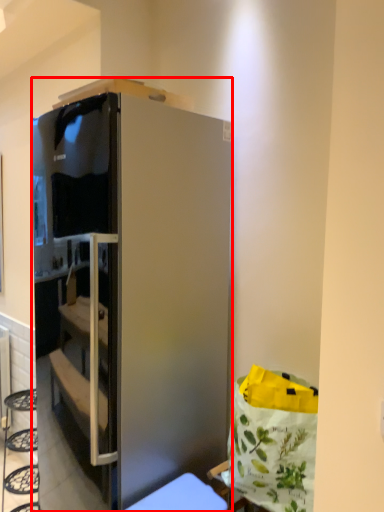
Question: Where is cabinetry (annotated by the red box) located in relation to furniture in the image?

Choices:
 (A) left
 (B) right

Answer: (A)